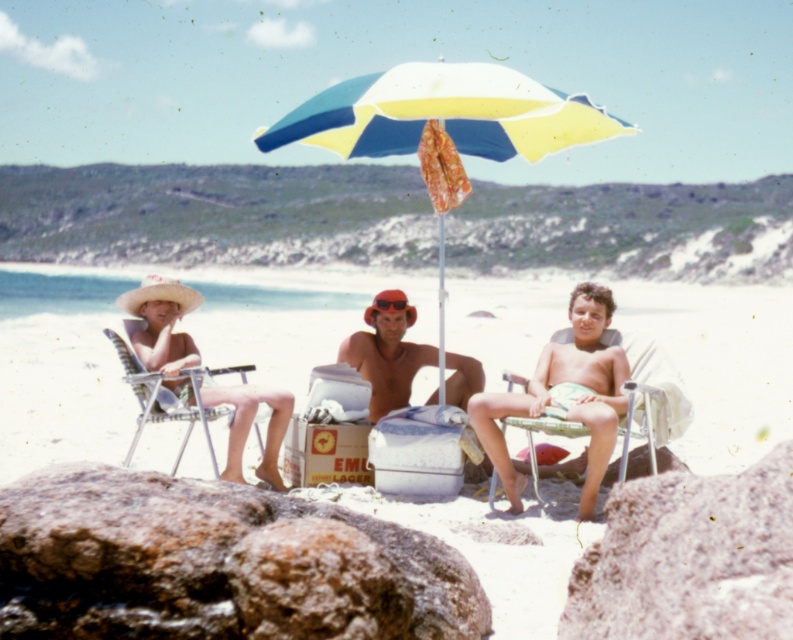
Does yellow and blue striped umbrella at center appear over matte red helmet at center?

Yes.

Which is in front, point (535, 97) or point (474, 388)?

Point (535, 97) is in front.

Find the location of a particular element. yellow and blue striped umbrella at center is located at coordinates (443, 113).

Does matte plastic chairs at center appear on the right side of matte red helmet at center?

Incorrect, matte plastic chairs at center is not on the right side of matte red helmet at center.

Is matte plastic chairs at center smaller than matte red helmet at center?

No.

The width and height of the screenshot is (793, 640). Describe the element at coordinates (404, 358) in the screenshot. I see `matte plastic chairs at center` at that location.

Identify the location of matte plastic chairs at center. (404, 358).

Is the position of white sand beach at center more distant than that of metallic silver beach chair at center?

That is False.

Can you confirm if white sand beach at center is positioned to the right of metallic silver beach chair at center?

In fact, white sand beach at center is to the left of metallic silver beach chair at center.

Between point (50, 291) and point (661, 385), which one is positioned behind?

Positioned behind is point (50, 291).

This screenshot has height=640, width=793. Find the location of `white sand beach at center`. white sand beach at center is located at coordinates (175, 328).